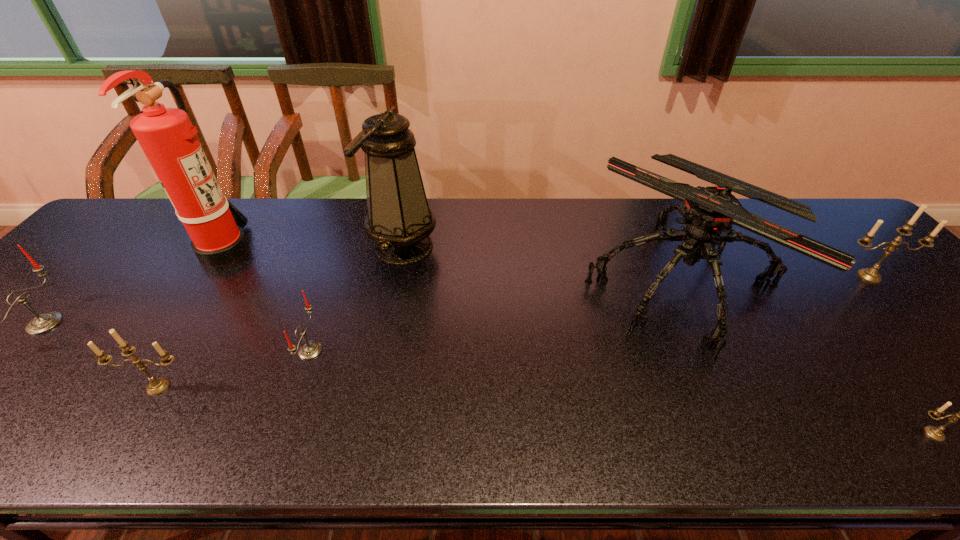
Locate an element on the screen. free space located on the front-facing side of the smaller red candle is located at coordinates (429, 350).

What are the coordinates of `fire extinguisher located at the far edge` in the screenshot? It's located at (166, 135).

The width and height of the screenshot is (960, 540). Find the location of `oil lamp at the far edge`. oil lamp at the far edge is located at coordinates (399, 220).

Identify the location of drone that is at the far edge. The image size is (960, 540). (710, 213).

You are a GUI agent. You are given a task and a screenshot of the screen. Output one action in this format:
    pyautogui.click(x=<x>, y=<y>)
    Task: Click on the object that is at the left edge
    The height and width of the screenshot is (540, 960).
    Given the screenshot: What is the action you would take?
    pyautogui.click(x=45, y=322)

You are a GUI agent. You are given a task and a screenshot of the screen. Output one action in this format:
    pyautogui.click(x=<x>, y=<y>)
    Task: Click on the object present at the right edge
    This screenshot has height=540, width=960.
    Given the screenshot: What is the action you would take?
    pyautogui.click(x=871, y=275)

In the image, there is a desktop. Where is `blank space at the far edge`? blank space at the far edge is located at coordinates (375, 244).

Locate an element on the screen. The width and height of the screenshot is (960, 540). vacant space at the near edge of the desktop is located at coordinates (908, 450).

You are a GUI agent. You are given a task and a screenshot of the screen. Output one action in this format:
    pyautogui.click(x=<x>, y=<y>)
    Task: Click on the blank region between the fifth object from left to right and the red fire extinguisher
    
    Given the screenshot: What is the action you would take?
    click(x=314, y=248)

Image resolution: width=960 pixels, height=540 pixels. I want to click on vacant area that lies between the leftmost candle and the oil lamp, so click(x=224, y=285).